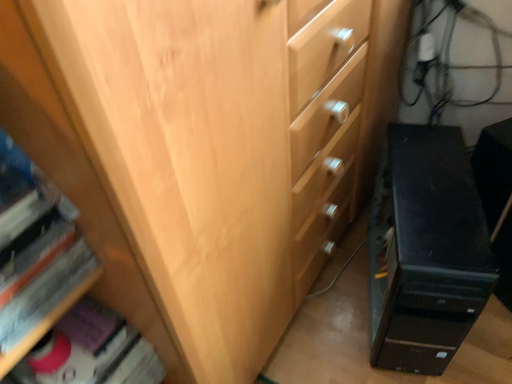
Identify the location of hardcover book at lower left, which appears as the 2th book when viewed from the back. The width and height of the screenshot is (512, 384). (35, 247).

You are a GUI agent. You are given a task and a screenshot of the screen. Output one action in this format:
    pyautogui.click(x=<x>, y=<y>)
    Task: Click on the hardcover book at lower left, the first book viewed from the top
    This screenshot has width=512, height=384.
    Given the screenshot: What is the action you would take?
    pyautogui.click(x=35, y=247)

Consider the image. Is matte pink book at lower left, arranged as the second book when viewed from the front, oriented towards hardcover book at lower left, which is the second book from bottom to top?

No, matte pink book at lower left, arranged as the second book when viewed from the front, is not aimed at hardcover book at lower left, which is the second book from bottom to top.

Does point (59, 355) come in front of point (7, 197)?

No, (59, 355) is further to viewer.

Are matte pink book at lower left, arranged as the second book when viewed from the front, and hardcover book at lower left, which is the second book from bottom to top, beside each other?

No, matte pink book at lower left, arranged as the second book when viewed from the front, is not making contact with hardcover book at lower left, which is the second book from bottom to top.

In the image, there is a hardcover book at lower left, which appears as the 2th book when viewed from the back. Where is `book below it (from a real-world perspective)`? book below it (from a real-world perspective) is located at coordinates (91, 351).

From the picture: Who is smaller, black plastic computer tower at lower right or hardcover book at lower left, which is the second book from bottom to top?

Smaller between the two is hardcover book at lower left, which is the second book from bottom to top.

Is hardcover book at lower left, which appears as the 1th book when viewed from the front, at the back of black plastic computer tower at lower right?

No, black plastic computer tower at lower right is not facing away from hardcover book at lower left, which appears as the 1th book when viewed from the front.

Does black plastic computer tower at lower right have a lesser height compared to hardcover book at lower left, the first book viewed from the top?

No.

Is matte pink book at lower left, placed as the 1th book when sorted from bottom to top, inside the boundaries of black plastic computer tower at lower right, or outside?

The correct answer is: outside.

How distant is matte pink book at lower left, which is the second book from top to bottom, from black plastic computer tower at lower right?

matte pink book at lower left, which is the second book from top to bottom, is 61.62 centimeters away from black plastic computer tower at lower right.

Is matte pink book at lower left, arranged as the second book when viewed from the front, taller than black plastic computer tower at lower right?

No.

From the image's perspective, is black plastic computer tower at lower right below matte pink book at lower left, placed as the 1th book when sorted from bottom to top?

Actually, black plastic computer tower at lower right appears above matte pink book at lower left, placed as the 1th book when sorted from bottom to top, in the image.

What's the angular difference between black plastic computer tower at lower right and matte pink book at lower left, the 1th book when ordered from back to front,'s facing directions?

67.3 degrees separate the facing orientations of black plastic computer tower at lower right and matte pink book at lower left, the 1th book when ordered from back to front.

From a real-world perspective, is black plastic computer tower at lower right under matte pink book at lower left, which is the second book from top to bottom?

Yes, from a real-world perspective, black plastic computer tower at lower right is below matte pink book at lower left, which is the second book from top to bottom.

Could matte pink book at lower left, the 1th book when ordered from back to front, be considered to be inside black plastic computer tower at lower right?

Definitely not — matte pink book at lower left, the 1th book when ordered from back to front, is not inside black plastic computer tower at lower right.

Would you say hardcover book at lower left, which appears as the 2th book when viewed from the back, is outside black plastic computer tower at lower right?

Indeed, hardcover book at lower left, which appears as the 2th book when viewed from the back, is completely outside black plastic computer tower at lower right.

Image resolution: width=512 pixels, height=384 pixels. I want to click on chest of drawers below the hardcover book at lower left, which appears as the 2th book when viewed from the back (from the image's perspective), so click(426, 251).

Looking at this image, is hardcover book at lower left, which appears as the 2th book when viewed from the back, further to the viewer compared to black plastic computer tower at lower right?

No, hardcover book at lower left, which appears as the 2th book when viewed from the back, is closer to the camera.

From the image's perspective, is hardcover book at lower left, which appears as the 1th book when viewed from the front, on top of matte pink book at lower left, which is the second book from top to bottom?

Correct, hardcover book at lower left, which appears as the 1th book when viewed from the front, appears higher than matte pink book at lower left, which is the second book from top to bottom, in the image.

Is point (26, 294) closer to viewer compared to point (76, 329)?

Yes, point (26, 294) is in front of point (76, 329).

Considering the sizes of objects hardcover book at lower left, which appears as the 2th book when viewed from the back, and matte pink book at lower left, arranged as the second book when viewed from the front, in the image provided, who is bigger, hardcover book at lower left, which appears as the 2th book when viewed from the back, or matte pink book at lower left, arranged as the second book when viewed from the front,?

Bigger between the two is hardcover book at lower left, which appears as the 2th book when viewed from the back.

Image resolution: width=512 pixels, height=384 pixels. Find the location of `book below the hardcover book at lower left, which is the second book from bottom to top (from the image's perspective)`. book below the hardcover book at lower left, which is the second book from bottom to top (from the image's perspective) is located at coordinates (91, 351).

The image size is (512, 384). What are the coordinates of `the 2nd book counting from the left side of the black plastic computer tower at lower right` in the screenshot? It's located at (35, 247).

When comparing their distances from hardcover book at lower left, which appears as the 2th book when viewed from the back, does matte pink book at lower left, the 1th book when ordered from back to front, or black plastic computer tower at lower right seem closer?

matte pink book at lower left, the 1th book when ordered from back to front.

Considering their positions, is hardcover book at lower left, the first book viewed from the top, positioned closer to matte pink book at lower left, which is the second book from top to bottom, than black plastic computer tower at lower right?

hardcover book at lower left, the first book viewed from the top.

When comparing their distances from hardcover book at lower left, the first book viewed from the top, does black plastic computer tower at lower right or matte pink book at lower left, placed as the 1th book when sorted from bottom to top, seem further?

black plastic computer tower at lower right is positioned further to the anchor hardcover book at lower left, the first book viewed from the top.

Which object lies further to the anchor point matte pink book at lower left, placed as the 1th book when sorted from bottom to top, black plastic computer tower at lower right or hardcover book at lower left, which appears as the 2th book when viewed from the back?

black plastic computer tower at lower right is positioned further to the anchor matte pink book at lower left, placed as the 1th book when sorted from bottom to top.

From the image, which object appears to be nearer to black plastic computer tower at lower right, hardcover book at lower left, which is the second book from bottom to top, or matte pink book at lower left, placed as the 1th book when sorted from bottom to top?

Among the two, matte pink book at lower left, placed as the 1th book when sorted from bottom to top, is located nearer to black plastic computer tower at lower right.

Considering their positions, is matte pink book at lower left, placed as the 1th book when sorted from bottom to top, positioned further to black plastic computer tower at lower right than hardcover book at lower left, the first book viewed from the top?

hardcover book at lower left, the first book viewed from the top, lies further to black plastic computer tower at lower right than the other object.

Image resolution: width=512 pixels, height=384 pixels. Find the location of `book between hardcover book at lower left, which appears as the 1th book when viewed from the front, and black plastic computer tower at lower right, in the horizontal direction`. book between hardcover book at lower left, which appears as the 1th book when viewed from the front, and black plastic computer tower at lower right, in the horizontal direction is located at coordinates (91, 351).